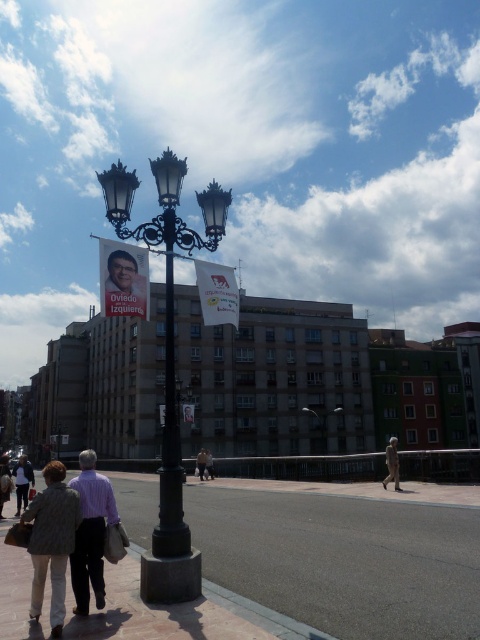
Based on the photo, is brown brick pavement at lower center thinner than smooth plastic face at center?

Incorrect, brown brick pavement at lower center's width is not less than smooth plastic face at center's.

Which is more to the right, brown brick pavement at lower center or smooth plastic face at center?

brown brick pavement at lower center is more to the right.

Which is behind, point (416, 518) or point (118, 284)?

The point (416, 518) is behind.

Identify the location of brown brick pavement at lower center. (344, 560).

Who is lower down, metallic streetlight at center or light brown leather jacket at lower left?

metallic streetlight at center is lower down.

Between metallic streetlight at center and light brown leather jacket at lower left, which one has more height?

metallic streetlight at center is taller.

Measure the distance between point [307,404] and camera.

A distance of 58.33 meters exists between point [307,404] and camera.

Image resolution: width=480 pixels, height=640 pixels. Identify the location of metallic streetlight at center. (323, 422).

Is metallic streetlight at center closer to camera compared to brown leather jacket at center?

Yes, it is.

This screenshot has height=640, width=480. I want to click on metallic streetlight at center, so click(x=323, y=422).